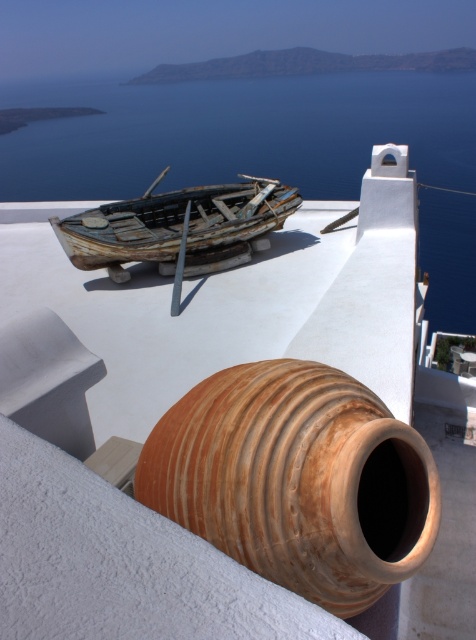
You are a delivery drone trying to land on the white surface where the brown clay pot at center is placed. The landing coordinates must be at least 0.1 units away from any object. Can you land safely?

The brown clay pot at center is located at point (297, 480). Since the landing coordinates need to be at least 0.1 units away from any object, you can choose a spot within the white surface that maintains this distance from the pot.

You are standing on a rooftop and see the brown clay pot at center and the rusty wood boat at center. Which object is closer to you?

The brown clay pot at center is closer to you because it is positioned under the rusty wood boat at center, meaning it is in a lower position relative to your viewpoint.

You are an artist planning to paint this coastal scene. You need to ensure that the blue water at upper center and the brown clay pot at center are proportionally accurate. Based on the scene description, which object should you make wider in your painting?

The blue water at upper center should be made wider in the painting since it might be wider than the brown clay pot at center according to the description.